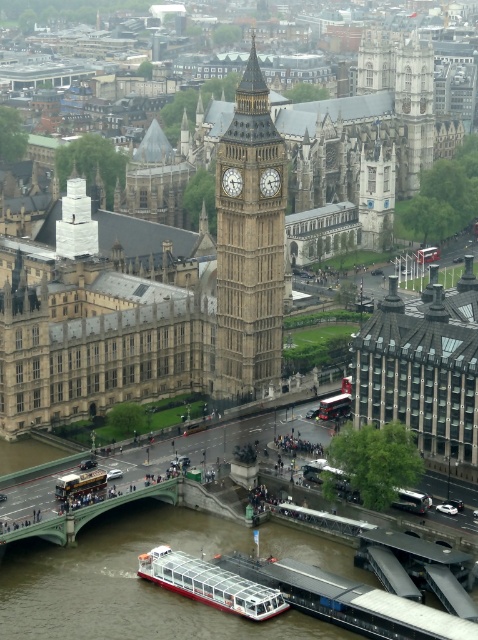
Does golden stone clock tower at center appear on the left side of white stone clock at center?

No, golden stone clock tower at center is not to the left of white stone clock at center.

Is golden stone clock tower at center thinner than white stone clock at center?

In fact, golden stone clock tower at center might be wider than white stone clock at center.

Who is more distant from viewer, (220, 378) or (237, 170)?

The point (220, 378) is behind.

You are a GUI agent. You are given a task and a screenshot of the screen. Output one action in this format:
    pyautogui.click(x=<x>, y=<y>)
    Task: Click on the golden stone clock tower at center
    
    Given the screenshot: What is the action you would take?
    pyautogui.click(x=249, y=248)

Does golden stone building at center have a smaller size compared to white glass boat at lower center?

Actually, golden stone building at center might be larger than white glass boat at lower center.

Does golden stone building at center have a lesser height compared to white glass boat at lower center?

No.

Is point (80, 230) positioned after point (152, 552)?

Yes.

The height and width of the screenshot is (640, 478). What are the coordinates of `golden stone building at center` in the screenshot? It's located at (206, 259).

From the picture: Does green painted concrete bridge at center have a larger size compared to white stone clock at center?

Correct, green painted concrete bridge at center is larger in size than white stone clock at center.

Can you confirm if green painted concrete bridge at center is taller than white stone clock at center?

Yes.

Where is `green painted concrete bridge at center`? The image size is (478, 640). green painted concrete bridge at center is located at coordinates (86, 515).